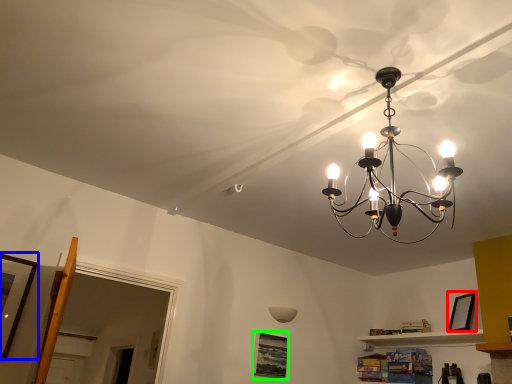
Question: Estimate the real-world distances between objects in this image. Which object is closer to picture frame (highlighted by a red box), picture frame (highlighted by a blue box) or picture frame (highlighted by a green box)?

Choices:
 (A) picture frame
 (B) picture frame

Answer: (B)